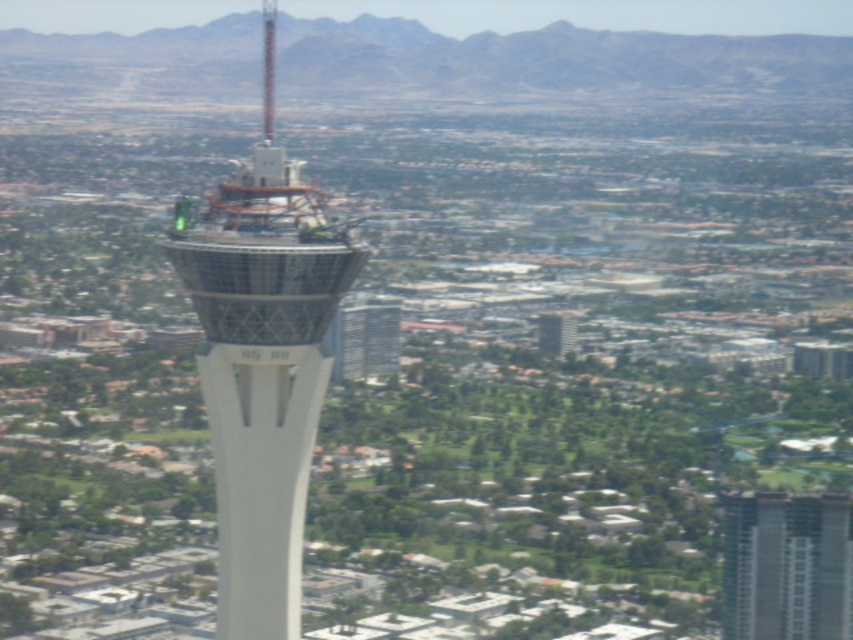
Question: Which of the following is the closest to the observer?

Choices:
 (A) (781, 493)
 (B) (274, 572)

Answer: (B)

Question: Is white glass tower at center below gray concrete building at center?

Choices:
 (A) no
 (B) yes

Answer: (A)

Question: Does white glass tower at center appear on the left side of gray concrete building at center?

Choices:
 (A) no
 (B) yes

Answer: (B)

Question: Can you confirm if white glass tower at center is positioned to the right of gray concrete building at center?

Choices:
 (A) yes
 (B) no

Answer: (B)

Question: Which of the following is the farthest from the observer?

Choices:
 (A) gray concrete building at center
 (B) white glass tower at center

Answer: (A)